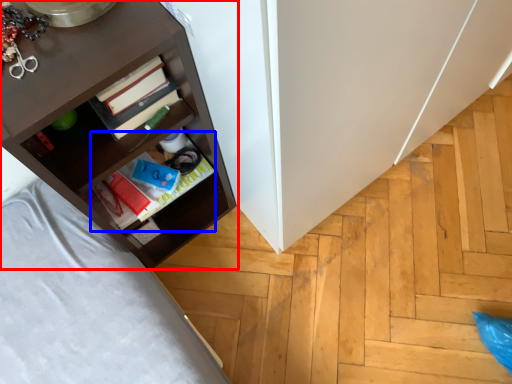
Question: Among these objects, which one is nearest to the camera, shelf (highlighted by a red box) or book (highlighted by a blue box)?

Choices:
 (A) shelf
 (B) book

Answer: (A)